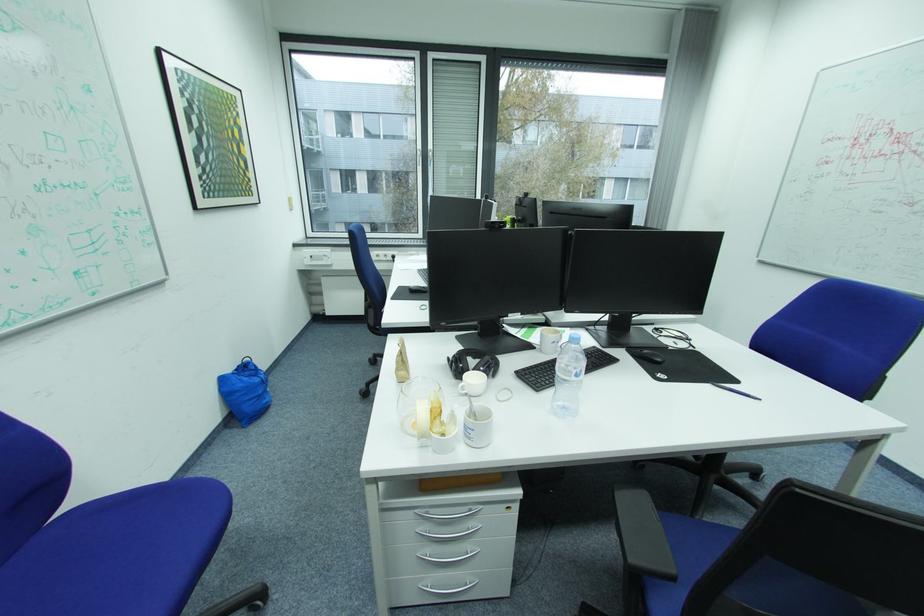
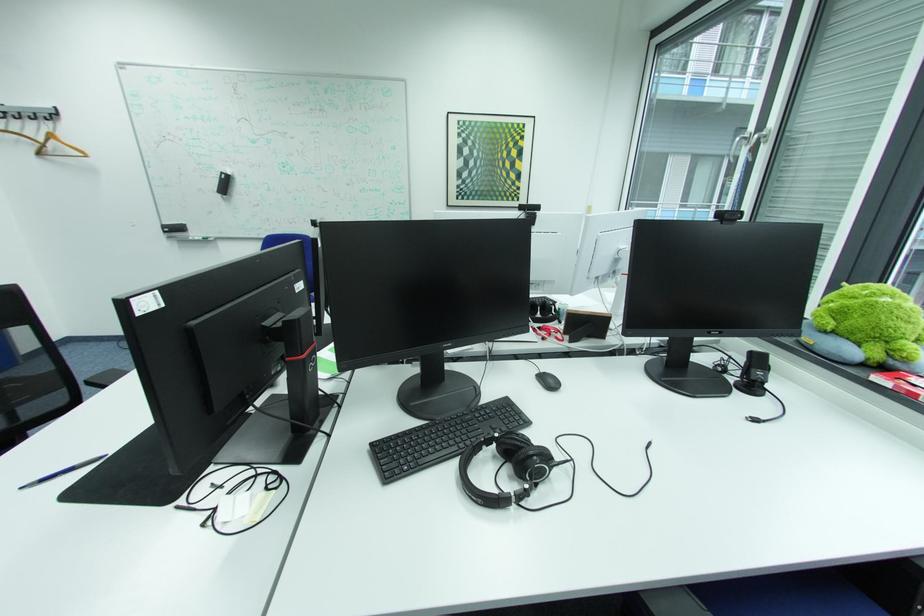
The point at (105,195) is marked in the first image. Where is the corresponding point in the second image?

(393, 195)